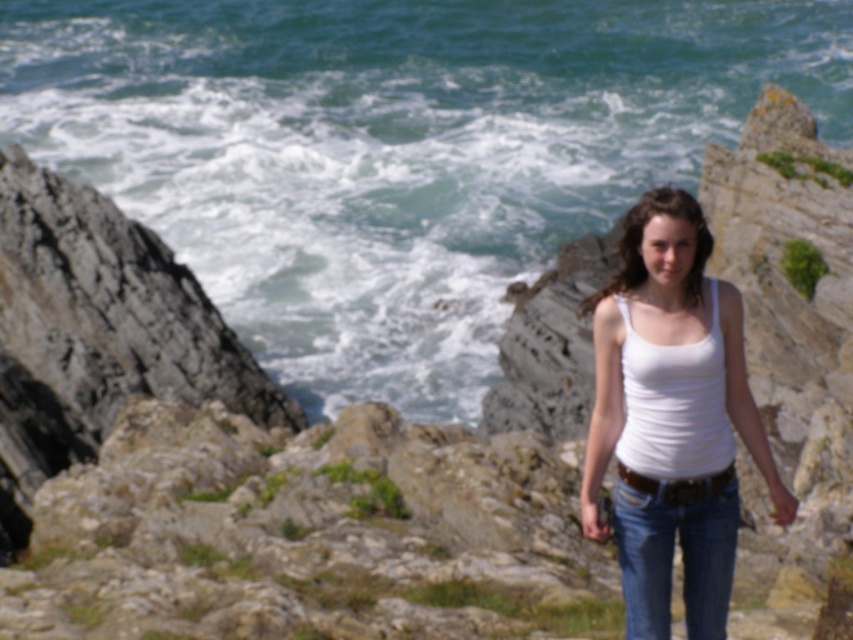
Question: Estimate the real-world distances between objects in this image. Which object is farther from the white cotton tank top at center?

Choices:
 (A) blue water at center
 (B) blue denim jeans at center

Answer: (A)

Question: Which point is closer to the camera?

Choices:
 (A) (712, 499)
 (B) (646, 522)

Answer: (B)

Question: Is blue water at center closer to the viewer compared to white cotton tank top at center?

Choices:
 (A) no
 (B) yes

Answer: (A)

Question: Considering the relative positions of white cotton tank top at center and blue denim jeans at center in the image provided, where is white cotton tank top at center located with respect to blue denim jeans at center?

Choices:
 (A) right
 (B) left

Answer: (A)

Question: Which of the following is the farthest from the observer?

Choices:
 (A) white cotton tank top at center
 (B) blue denim jeans at center
 (C) blue water at center

Answer: (C)

Question: Is blue water at center to the right of blue denim jeans at center from the viewer's perspective?

Choices:
 (A) no
 (B) yes

Answer: (B)